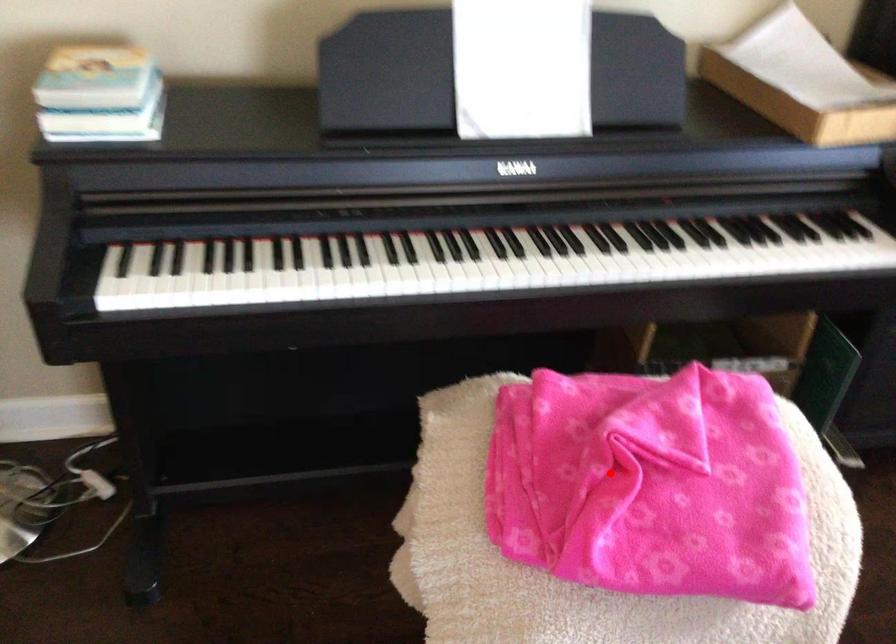
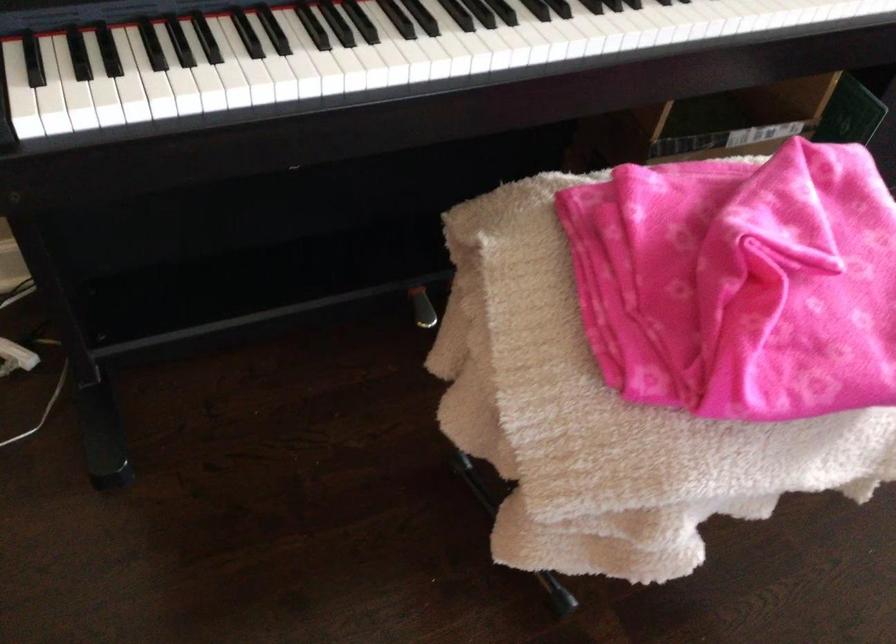
Question: I am providing you with two images of the same scene from different viewpoints. A red point is shown in image1. For the corresponding object point in image2, is it positioned nearer or farther from the camera?

Choices:
 (A) Nearer
 (B) Farther

Answer: (A)